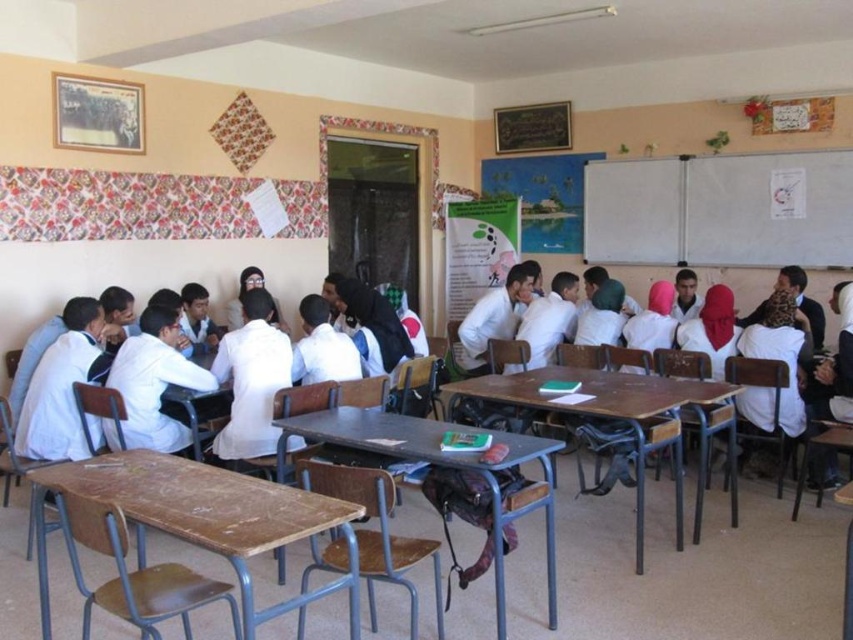
Question: Which point appears farthest from the camera in this image?

Choices:
 (A) (241, 566)
 (B) (392, 420)

Answer: (B)

Question: Considering the real-world distances, which object is closest to the white matte coat at center?

Choices:
 (A) white matte whiteboard at upper right
 (B) wooden desk at lower left
 (C) white matte uniform at center

Answer: (C)

Question: Can you confirm if wooden desk at lower left is positioned above wooden table at center?

Choices:
 (A) no
 (B) yes

Answer: (A)

Question: Which of the following is the closest to the observer?

Choices:
 (A) white matte uniform at center
 (B) white matte whiteboard at upper right
 (C) wooden desk at center

Answer: (C)

Question: From the image, what is the correct spatial relationship of white matte whiteboard at upper right in relation to wooden desk at lower left?

Choices:
 (A) above
 (B) below

Answer: (A)

Question: Is wooden desk at lower left below white matte uniform at center?

Choices:
 (A) yes
 (B) no

Answer: (A)